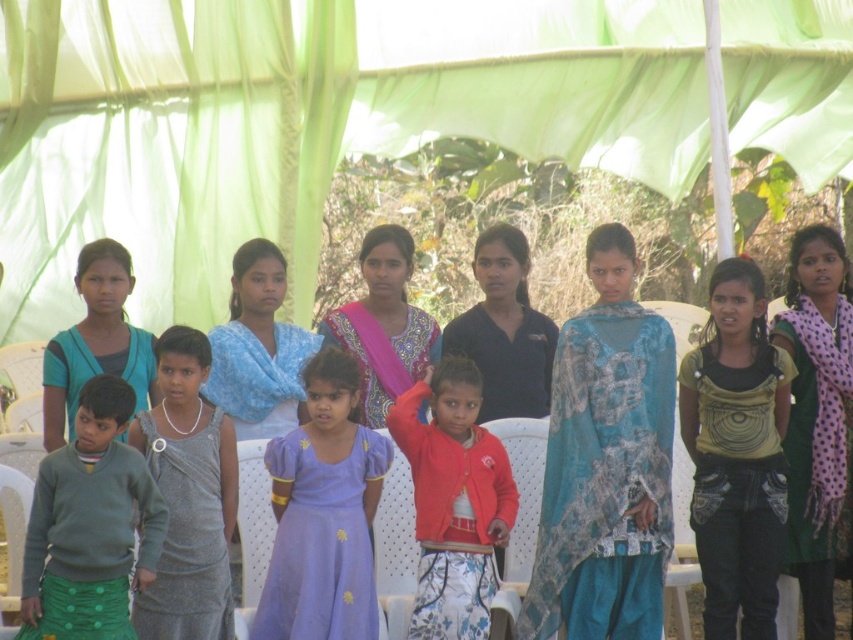
Is polka dot scarf at right bigger than black matte shirt at center?

Yes.

Who is more forward, (x=825, y=586) or (x=474, y=323)?

Positioned in front is point (x=825, y=586).

Locate an element on the screen. This screenshot has height=640, width=853. polka dot scarf at right is located at coordinates (816, 413).

Is sparkly silver dress at center to the right of black matte shirt at center from the viewer's perspective?

Incorrect, sparkly silver dress at center is not on the right side of black matte shirt at center.

Can you confirm if sparkly silver dress at center is positioned to the left of black matte shirt at center?

Correct, you'll find sparkly silver dress at center to the left of black matte shirt at center.

Locate an element on the screen. Image resolution: width=853 pixels, height=640 pixels. sparkly silver dress at center is located at coordinates (189, 536).

From the picture: Is blue printed fabric dress at center to the left of printed cotton saree at center from the viewer's perspective?

In fact, blue printed fabric dress at center is to the right of printed cotton saree at center.

Does blue printed fabric dress at center have a greater height compared to printed cotton saree at center?

Indeed, blue printed fabric dress at center has a greater height compared to printed cotton saree at center.

The height and width of the screenshot is (640, 853). In order to click on blue printed fabric dress at center in this screenshot , I will do coord(606,464).

Image resolution: width=853 pixels, height=640 pixels. Find the location of `blue printed fabric dress at center`. blue printed fabric dress at center is located at coordinates (606, 464).